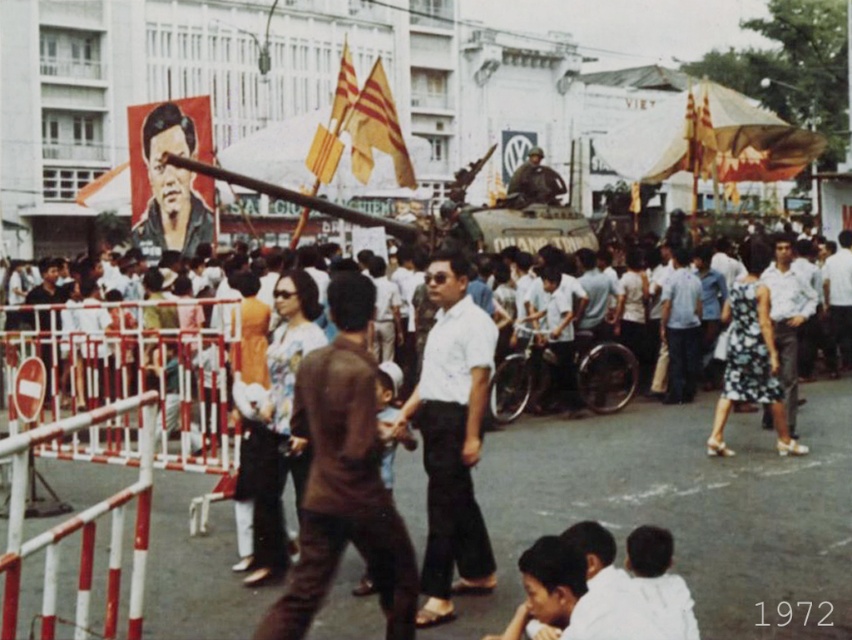
Between point (360, 420) and point (566, 244), which one is positioned behind?

The point (566, 244) is more distant.

What do you see at coordinates (343, 477) in the screenshot? I see `brown matte shirt at center` at bounding box center [343, 477].

Identify the location of brown matte shirt at center. This screenshot has width=852, height=640. (343, 477).

Which of these two, matte black portrait at upper left or green camouflage tank at center, stands taller?

matte black portrait at upper left

What do you see at coordinates (170, 176) in the screenshot?
I see `matte black portrait at upper left` at bounding box center [170, 176].

Which is in front, point (171, 202) or point (556, 234)?

Point (171, 202)

Find the location of a particular element. This screenshot has width=852, height=640. matte black portrait at upper left is located at coordinates point(170,176).

Is white matte shirt at center taller than yellowmaterial/textureflag at upper center?

Correct, white matte shirt at center is much taller as yellowmaterial/textureflag at upper center.

Is the position of white matte shirt at center less distant than that of yellowmaterial/textureflag at upper center?

Yes, it is in front of yellowmaterial/textureflag at upper center.

Measure the distance between white matte shirt at center and camera.

101.61 feet

The image size is (852, 640). What are the coordinates of `white matte shirt at center` in the screenshot? It's located at (452, 438).